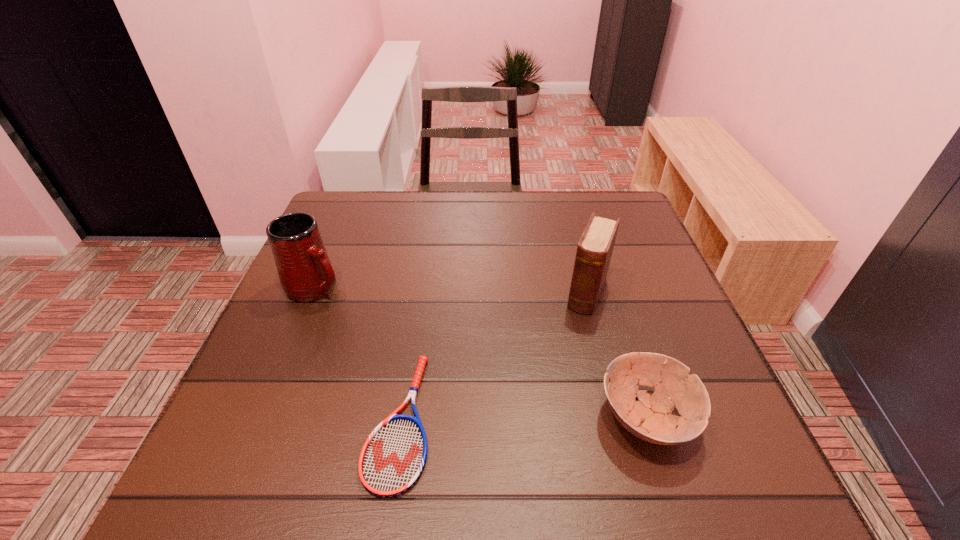
The image size is (960, 540). In order to click on free spot at the near edge of the desktop in this screenshot , I will do `click(430, 435)`.

Where is `vacant area at the left edge`? Image resolution: width=960 pixels, height=540 pixels. vacant area at the left edge is located at coordinates (340, 332).

Find the location of a particular element. free space at the far left corner of the desktop is located at coordinates pyautogui.click(x=375, y=205).

Image resolution: width=960 pixels, height=540 pixels. Identify the location of vacant space at the near left corner. (314, 417).

The height and width of the screenshot is (540, 960). What are the coordinates of `free space at the far right corner` in the screenshot? It's located at (616, 214).

At what (x,y) coordinates should I click in order to perform the action: click on free space between the mug and the diary. Please return your answer as a coordinate pair (x, y). Looking at the image, I should click on (452, 290).

You are a GUI agent. You are given a task and a screenshot of the screen. Output one action in this format:
    pyautogui.click(x=<x>, y=<y>)
    Task: Click on the empty space that is in between the diary and the second object from left to right
    
    Given the screenshot: What is the action you would take?
    pyautogui.click(x=493, y=357)

You are a GUI agent. You are given a task and a screenshot of the screen. Output one action in this format:
    pyautogui.click(x=<x>, y=<y>)
    Task: Click on the free point between the shortest object and the third tallest object
    This screenshot has width=960, height=540.
    Given the screenshot: What is the action you would take?
    pyautogui.click(x=522, y=419)

At what (x,y) coordinates should I click in order to perform the action: click on empty space that is in between the mug and the bowl. Please return your answer as a coordinate pair (x, y). Looking at the image, I should click on (481, 352).

What are the coordinates of `vacant area that lies between the diary and the mug` in the screenshot? It's located at [452, 290].